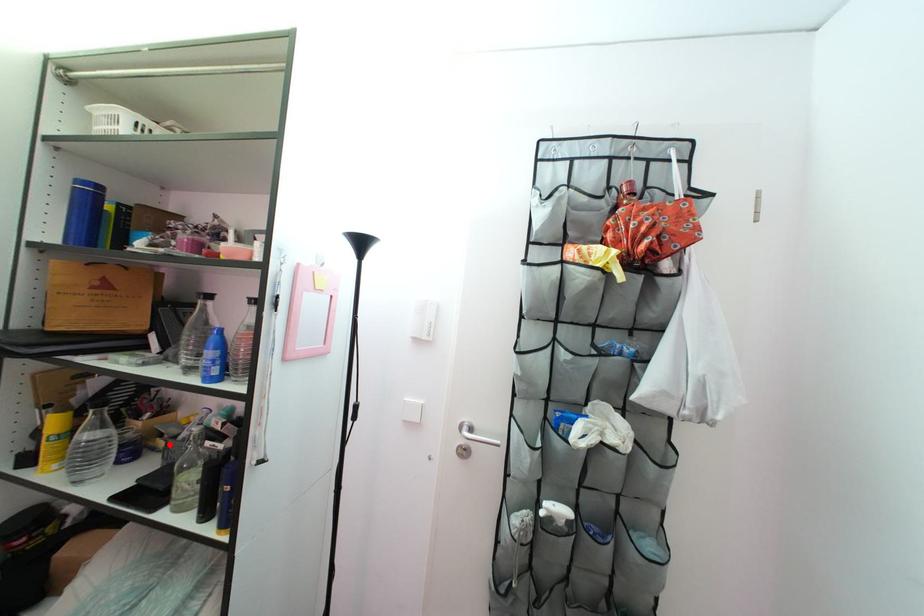
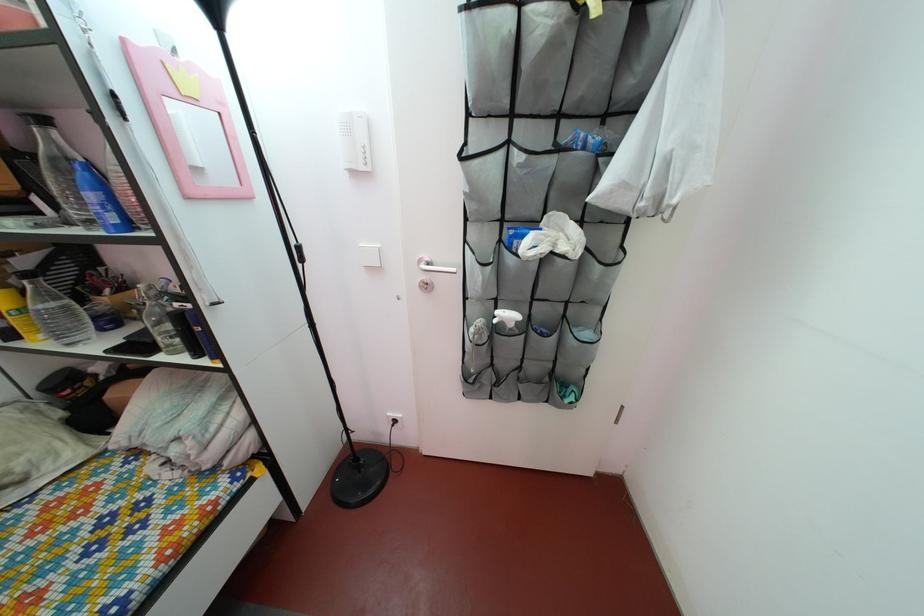
Find the pixel in the second image that matches the highlighted location in the first image.

(140, 315)